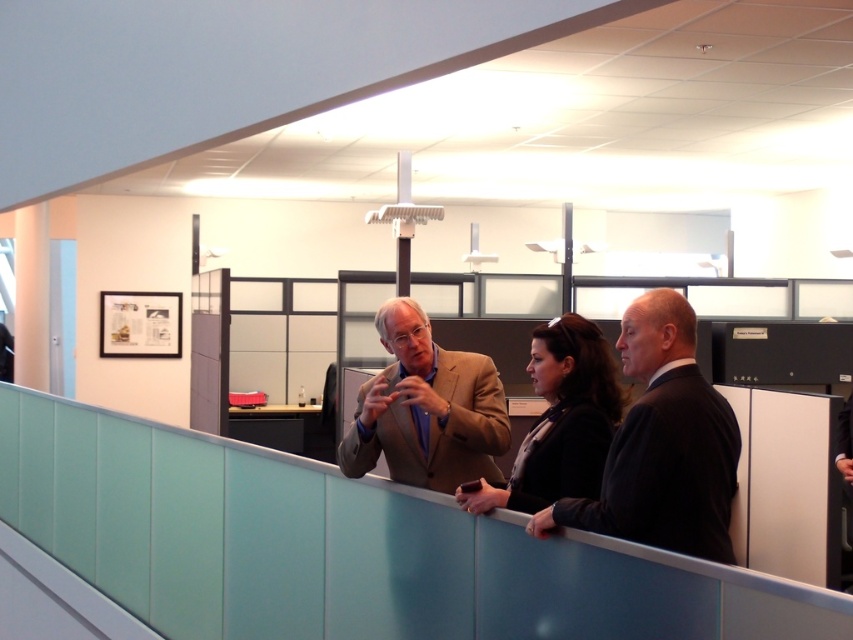
You are an office worker who needs to locate the black wool suit at right in the office scene. According to the coordinates provided, where would you find it?

The black wool suit at right is located at coordinates point [666,472].

You are an office worker who needs to choose between two jackets to wear today. You have a tan fabric suit at center and a matte black jacket at center. Which one is wider?

The tan fabric suit at center is wider than the matte black jacket at center according to the description.